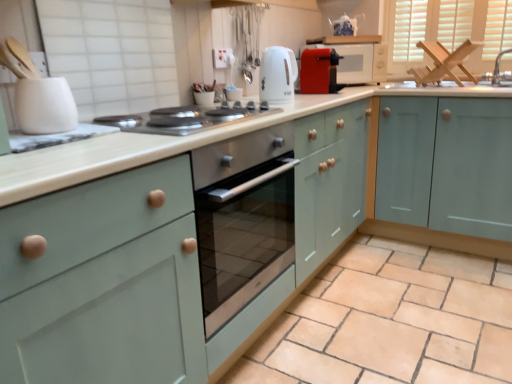
Find the location of a particular element. The image size is (512, 384). vacant area to the right of white glossy electric kettle at upper center, acting as the second kitchen appliance starting from the top is located at coordinates (313, 102).